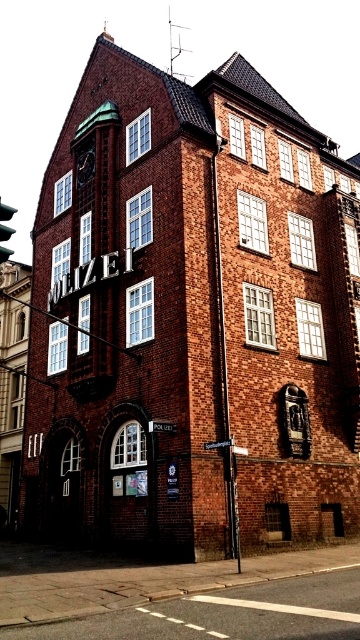
Question: Estimate the real-world distances between objects in this image. Which object is closer to the red glass traffic light at left?

Choices:
 (A) metallic silver street sign at center
 (B) brass clock face at upper left

Answer: (A)

Question: Which of the following is the closest to the observer?

Choices:
 (A) red glass traffic light at left
 (B) metallic silver street sign at center
 (C) brass clock face at upper left

Answer: (A)

Question: Can you confirm if brass clock face at upper left is bigger than metallic silver street sign at center?

Choices:
 (A) no
 (B) yes

Answer: (A)

Question: Is red glass traffic light at left positioned in front of metallic silver street sign at center?

Choices:
 (A) yes
 (B) no

Answer: (A)

Question: Which of the following is the closest to the observer?

Choices:
 (A) (86, 164)
 (B) (218, 449)

Answer: (B)

Question: Is the position of brass clock face at upper left less distant than that of metallic silver street sign at center?

Choices:
 (A) yes
 (B) no

Answer: (B)